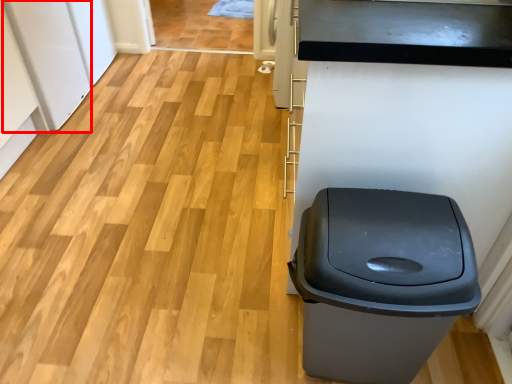
Question: From the image's perspective, what is the correct spatial positioning of appliance (annotated by the red box) in reference to waste container?

Choices:
 (A) above
 (B) below

Answer: (A)